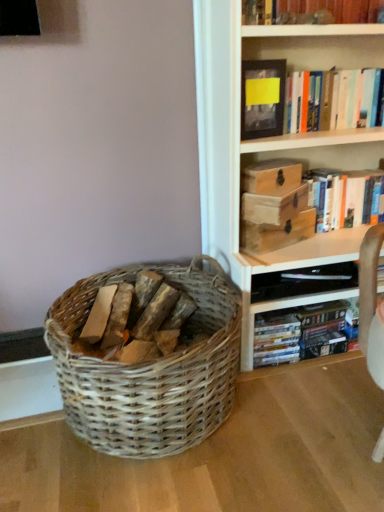
Identify the location of free location to the right of woven wood basket at lower left. (310, 416).